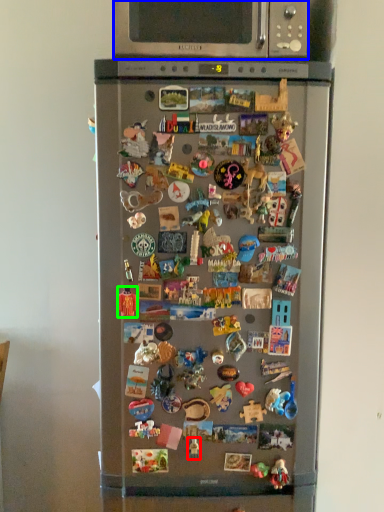
Question: Estimate the real-world distances between objects in this image. Which object is closer to toy (highlighted by a red box), microwave oven (highlighted by a blue box) or toy (highlighted by a green box)?

Choices:
 (A) microwave oven
 (B) toy

Answer: (B)